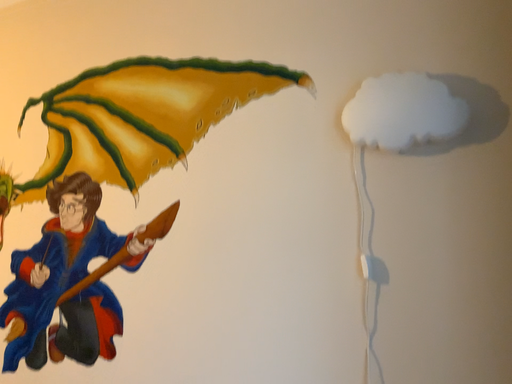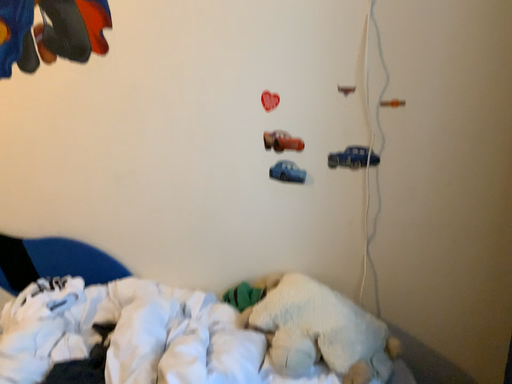
Question: Which way did the camera rotate in the video?

Choices:
 (A) rotated downward
 (B) rotated upward

Answer: (A)